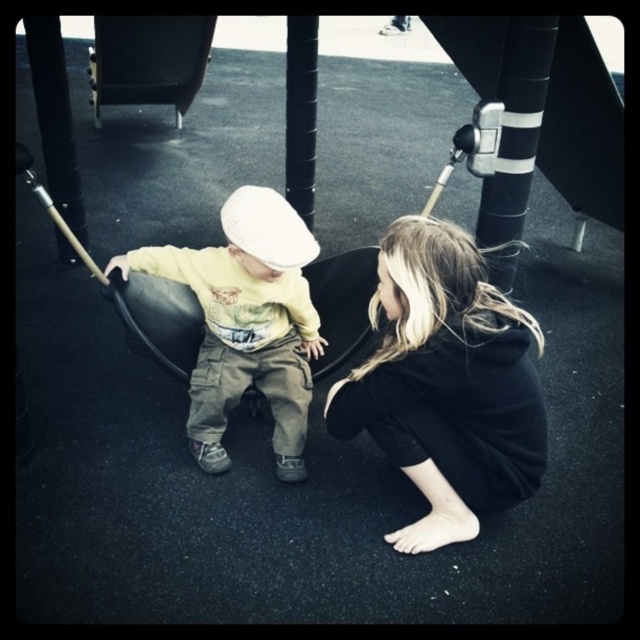
You are a parent trying to locate your child in a crowded indoor playground. You remember your child has black soft hair at lower center and is wearing a matte yellow shirt at center. Based on the scene description, which object is positioned lower in relation to the other?

The black soft hair at lower center is positioned below the matte yellow shirt at center.

Based on the scene description, where exactly is the black soft hair at lower center located in the image?

The black soft hair at lower center is located at point coordinates of 0.600 on the x axis and 0.697 on the y axis.

You are a photographer trying to capture a candid shot of the black soft hair at lower center and the matte yellow shirt at center. Which object should you focus on first if you want to ensure both are in focus without adjusting the camera settings?

The black soft hair at lower center is taller than the matte yellow shirt at center, so focusing on the taller object first would help ensure both are in focus as they are closer in height.